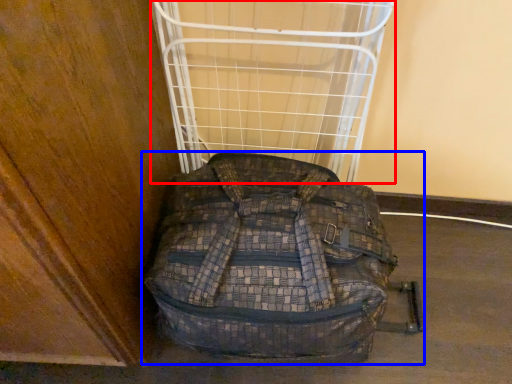
Question: Among these objects, which one is nearest to the camera, cage (highlighted by a red box) or backpack (highlighted by a blue box)?

Choices:
 (A) cage
 (B) backpack

Answer: (B)